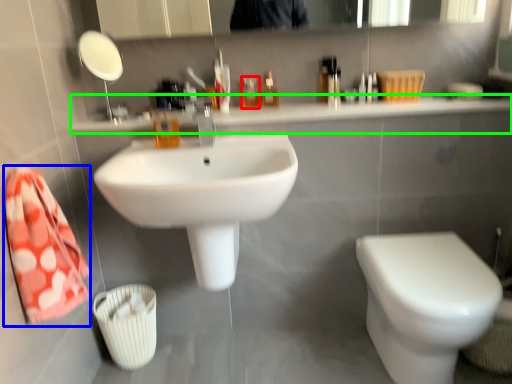
Question: Which object is the closest to the mouthwash (highlighted by a red box)? Choose among these: bath towel (highlighted by a blue box) or counter top (highlighted by a green box).

Choices:
 (A) bath towel
 (B) counter top

Answer: (B)